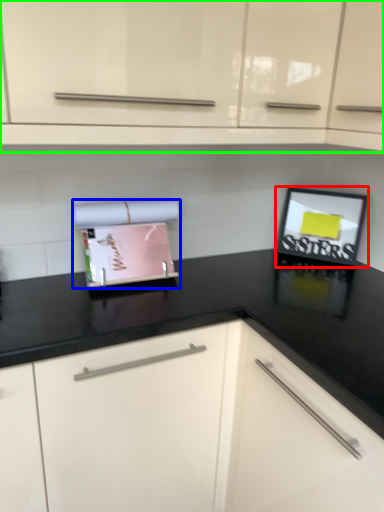
Question: Which is nearer to the picture frame (highlighted by a red box)? appliance (highlighted by a blue box) or cabinetry (highlighted by a green box).

Choices:
 (A) appliance
 (B) cabinetry

Answer: (A)